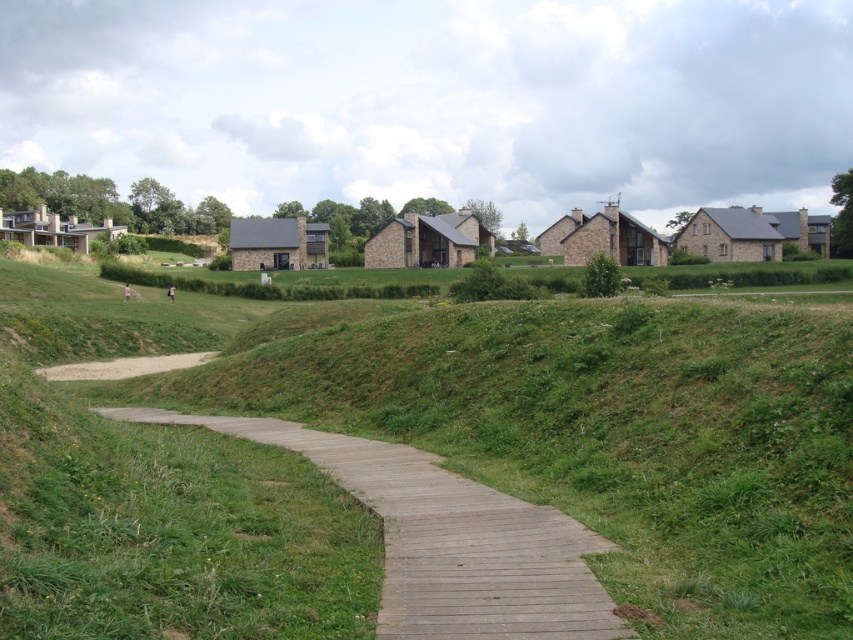
Question: Can you confirm if green grassy at center is wider than wooden boardwalk at center?

Choices:
 (A) yes
 (B) no

Answer: (A)

Question: Among these points, which one is farthest from the camera?

Choices:
 (A) (372, 531)
 (B) (437, 637)

Answer: (A)

Question: Where is green grassy at center located in relation to wooden boardwalk at center in the image?

Choices:
 (A) left
 (B) right

Answer: (A)

Question: Which point is closer to the camera?

Choices:
 (A) wooden boardwalk at center
 (B) green grassy at center

Answer: (B)

Question: Which point is farther to the camera?

Choices:
 (A) wooden boardwalk at center
 (B) green grassy at center

Answer: (A)

Question: Does green grassy at center lie behind wooden boardwalk at center?

Choices:
 (A) no
 (B) yes

Answer: (A)